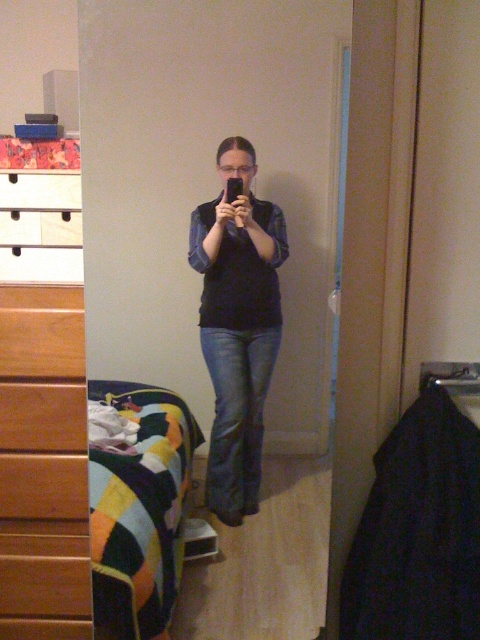
Question: Which point is farther from the camera taking this photo?

Choices:
 (A) (157, 588)
 (B) (216, 204)
 (C) (44, 497)
 (D) (80, 196)

Answer: (A)

Question: Is denim jeans at center positioned behind brushed metal drawer at left?

Choices:
 (A) no
 (B) yes

Answer: (A)

Question: Which point appears farthest from the camera in this image?

Choices:
 (A) (224, 321)
 (B) (100, 461)
 (C) (81, 282)
 (D) (81, 481)

Answer: (B)

Question: Which point is closer to the camera?

Choices:
 (A) white wood drawer at upper left
 (B) wooden dresser at left
 (C) brushed metal drawer at left

Answer: (A)

Question: Is the position of white wood drawer at upper left more distant than that of brushed metal drawer at left?

Choices:
 (A) no
 (B) yes

Answer: (A)

Question: Considering the relative positions of wooden dresser at left and multicolored fabric bed at lower left in the image provided, where is wooden dresser at left located with respect to multicolored fabric bed at lower left?

Choices:
 (A) left
 (B) right

Answer: (A)